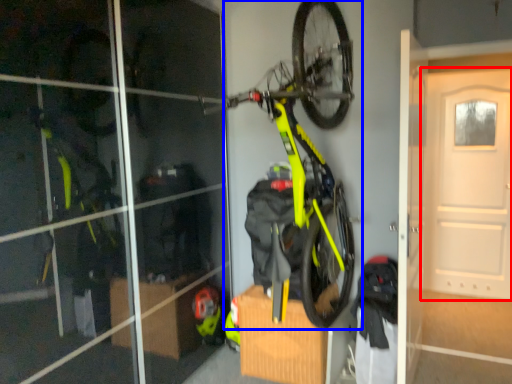
Question: Which object appears farthest to the camera in this image, door (highlighted by a red box) or bicycle (highlighted by a blue box)?

Choices:
 (A) door
 (B) bicycle

Answer: (A)